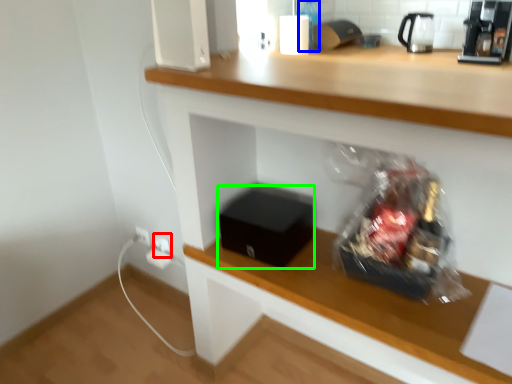
Question: Estimate the real-world distances between objects in this image. Which object is closer to electric outlet (highlighted by a red box), bottle (highlighted by a blue box) or box (highlighted by a green box)?

Choices:
 (A) bottle
 (B) box

Answer: (B)